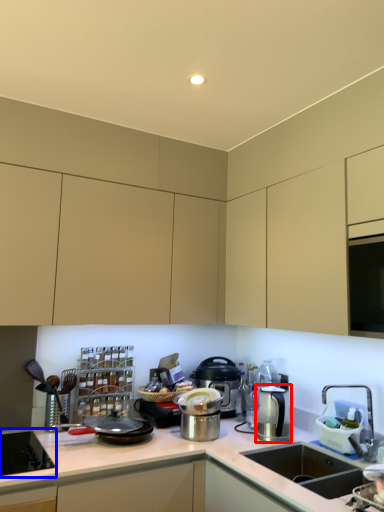
Question: Among these objects, which one is nearest to the camera, kitchen appliance (highlighted by a red box) or home appliance (highlighted by a blue box)?

Choices:
 (A) kitchen appliance
 (B) home appliance

Answer: (B)